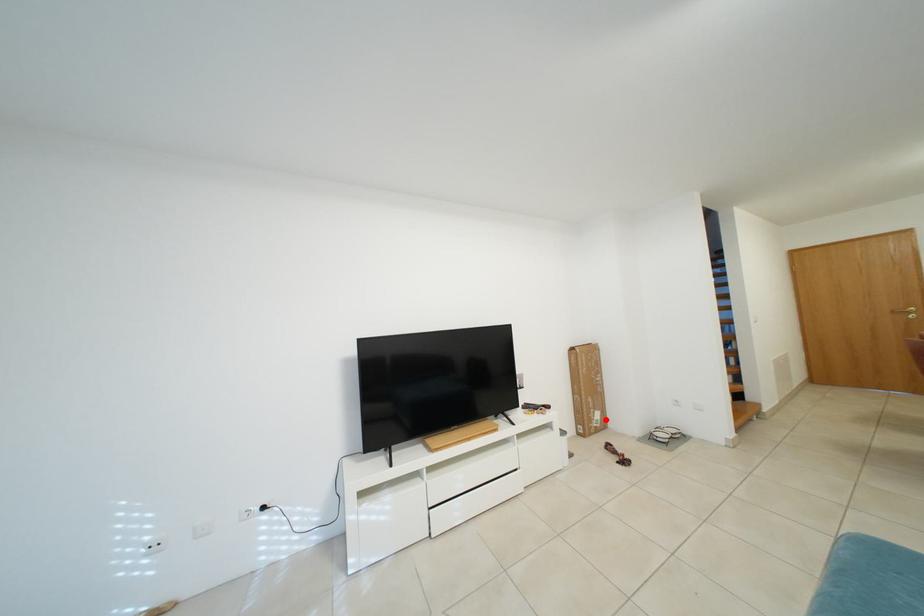
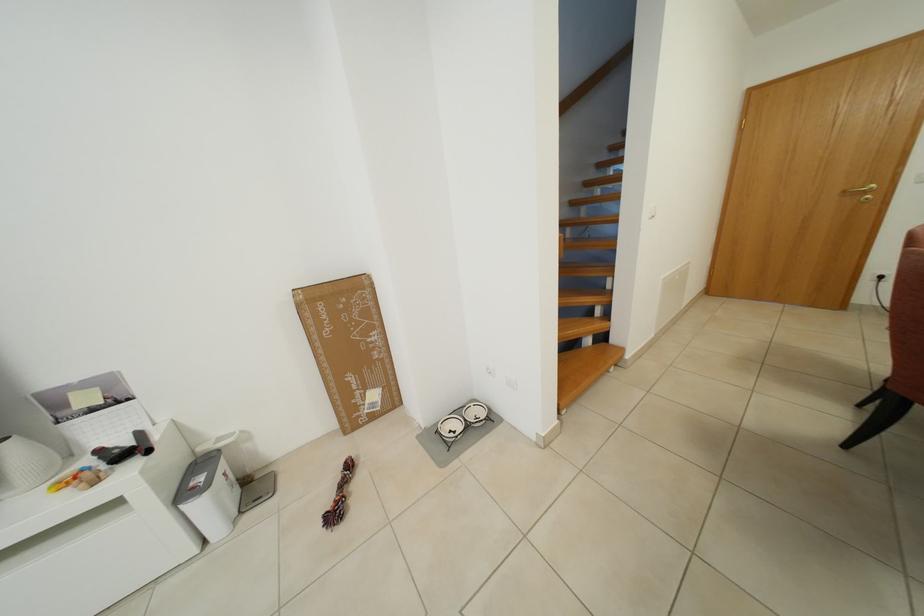
Where in the second image is the point corresponding to the highlighted location from the first image?

(382, 400)